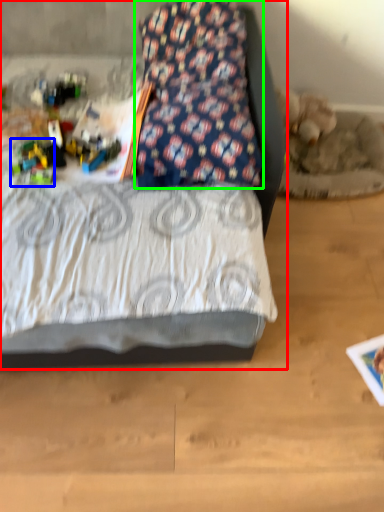
Question: Which object is positioned closest to bed (highlighted by a red box)? Select from toy (highlighted by a blue box) and pillow (highlighted by a green box).

Choices:
 (A) toy
 (B) pillow

Answer: (A)